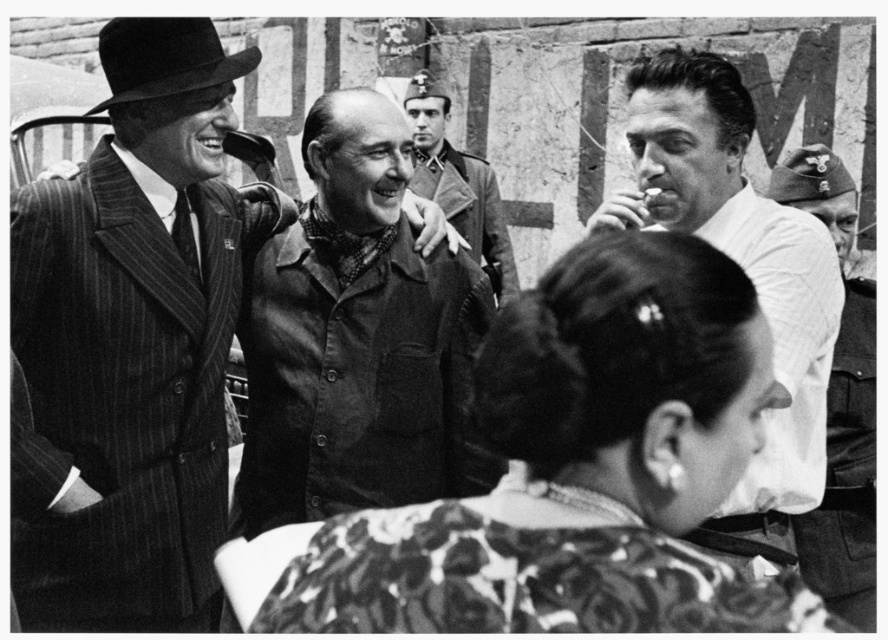
Question: Can you confirm if white matte shirt at upper right is positioned to the right of smooth leather hat at right?

Choices:
 (A) no
 (B) yes

Answer: (A)

Question: Does white matte shirt at upper right have a lesser width compared to smooth leather jacket at center?

Choices:
 (A) no
 (B) yes

Answer: (A)

Question: Which point is farther to the camera?

Choices:
 (A) (435, 157)
 (B) (549, 483)
 (C) (42, 548)
 (D) (783, 170)

Answer: (A)

Question: Which point is farther to the camera?

Choices:
 (A) smooth leather jacket at center
 (B) floral-patterned blouse at center

Answer: (A)

Question: Is striped wool suit at center in front of smooth leather hat at right?

Choices:
 (A) yes
 (B) no

Answer: (A)

Question: Based on their relative distances, which object is farther from the floral-patterned blouse at center?

Choices:
 (A) smooth leather hat at right
 (B) smooth leather jacket at center
 (C) striped wool suit at center
 (D) white matte shirt at upper right

Answer: (B)